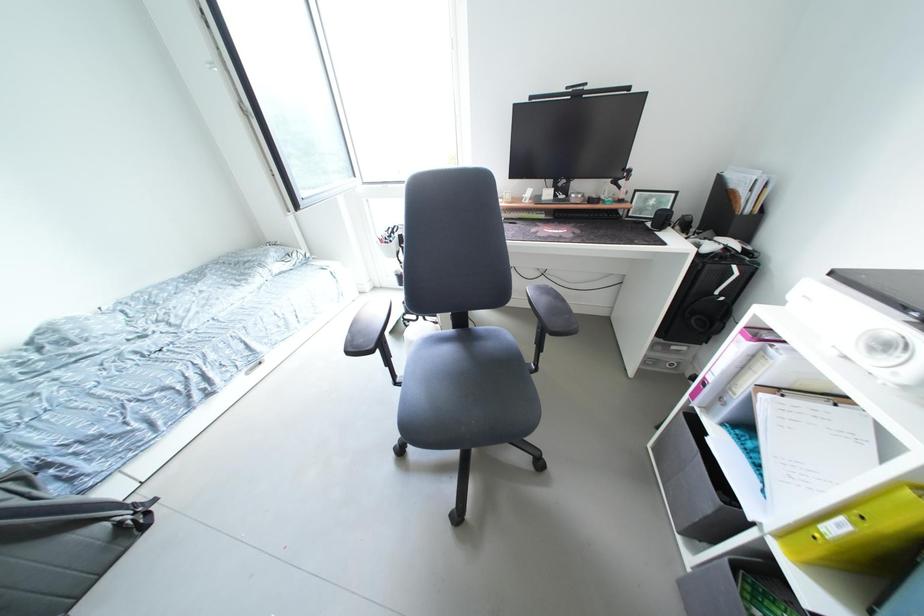
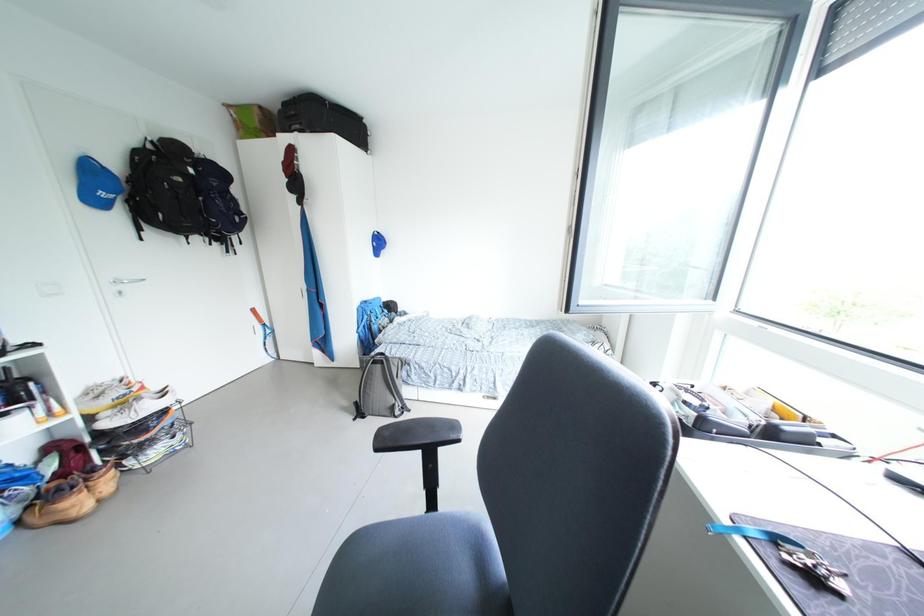
Question: The camera is either moving clockwise (left) or counter-clockwise (right) around the object. The first image is from the beginning of the video and the second image is from the end. Is the camera moving left or right when shooting the video?

Choices:
 (A) Left
 (B) Right

Answer: (B)